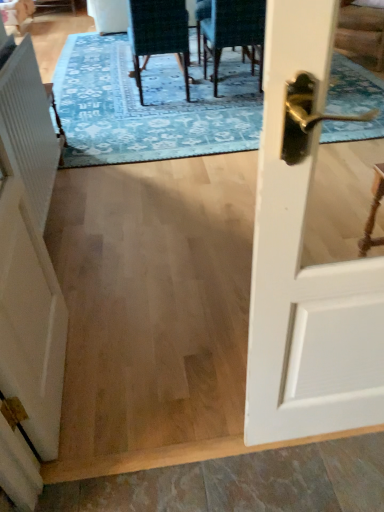
Question: Can you confirm if white glossy door handle at right is shorter than white matte barn door at left?

Choices:
 (A) yes
 (B) no

Answer: (B)

Question: Does white glossy door handle at right have a lesser width compared to white matte barn door at left?

Choices:
 (A) yes
 (B) no

Answer: (A)

Question: From a real-world perspective, is white glossy door handle at right located higher than white matte barn door at left?

Choices:
 (A) no
 (B) yes

Answer: (B)

Question: Does white glossy door handle at right turn towards white matte barn door at left?

Choices:
 (A) no
 (B) yes

Answer: (A)

Question: Considering the relative sizes of white glossy door handle at right and white matte barn door at left in the image provided, is white glossy door handle at right bigger than white matte barn door at left?

Choices:
 (A) no
 (B) yes

Answer: (A)

Question: Can you see white glossy door handle at right touching white matte barn door at left?

Choices:
 (A) no
 (B) yes

Answer: (A)

Question: From a real-world perspective, is white matte barn door at left on velvet dark green chair at center, the 2th chair viewed from the right?

Choices:
 (A) no
 (B) yes

Answer: (B)

Question: Is white matte barn door at left shorter than velvet dark green chair at center, marked as the first chair in a left-to-right arrangement?

Choices:
 (A) no
 (B) yes

Answer: (A)

Question: Considering the relative sizes of white matte barn door at left and velvet dark green chair at center, marked as the first chair in a left-to-right arrangement, in the image provided, is white matte barn door at left bigger than velvet dark green chair at center, marked as the first chair in a left-to-right arrangement,?

Choices:
 (A) no
 (B) yes

Answer: (A)

Question: Is white matte barn door at left next to velvet dark green chair at center, marked as the first chair in a left-to-right arrangement, and touching it?

Choices:
 (A) no
 (B) yes

Answer: (A)

Question: Is white matte barn door at left smaller than velvet dark green chair at center, the 2th chair viewed from the right?

Choices:
 (A) yes
 (B) no

Answer: (A)

Question: From the image's perspective, is white matte barn door at left located beneath velvet dark green chair at center, the 2th chair viewed from the right?

Choices:
 (A) yes
 (B) no

Answer: (A)

Question: Is velvet dark green chair at upper center, the 2th chair when ordered from left to right, oriented away from white matte barn door at left?

Choices:
 (A) yes
 (B) no

Answer: (B)